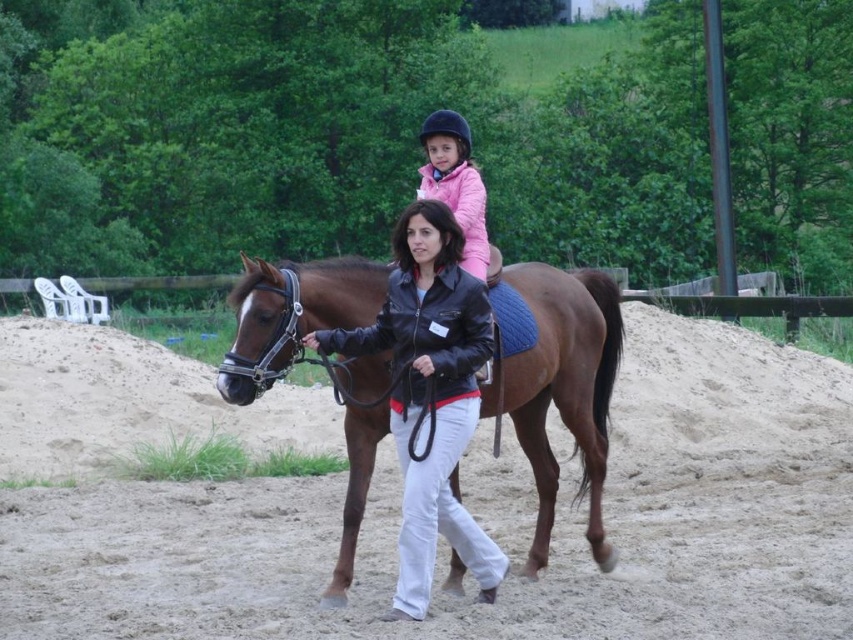
Question: Estimate the real-world distances between objects in this image. Which object is farther from the brown glossy horse at center?

Choices:
 (A) black leather jacket at center
 (B) sandy brown at lower center

Answer: (B)

Question: Considering the real-world distances, which object is closest to the brown glossy horse at center?

Choices:
 (A) black leather jacket at center
 (B) sandy brown at lower center

Answer: (A)

Question: Can you confirm if sandy brown at lower center is positioned below brown glossy horse at center?

Choices:
 (A) no
 (B) yes

Answer: (B)

Question: Is sandy brown at lower center wider than brown glossy horse at center?

Choices:
 (A) yes
 (B) no

Answer: (A)

Question: Which point is farther to the camera?

Choices:
 (A) sandy brown at lower center
 (B) brown glossy horse at center

Answer: (B)

Question: Where is brown glossy horse at center located in relation to black leather jacket at center in the image?

Choices:
 (A) above
 (B) below

Answer: (B)